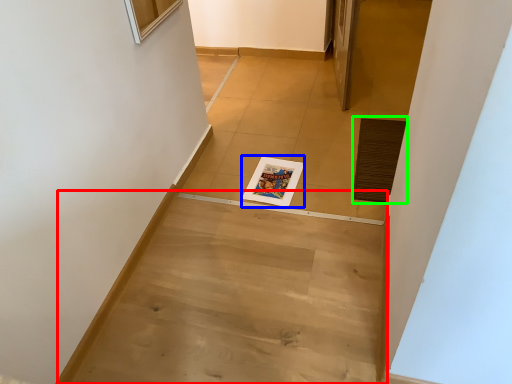
Question: Which is nearer to the stairwell (highlighted by a red box)? magazine (highlighted by a blue box) or doormat (highlighted by a green box).

Choices:
 (A) magazine
 (B) doormat

Answer: (A)